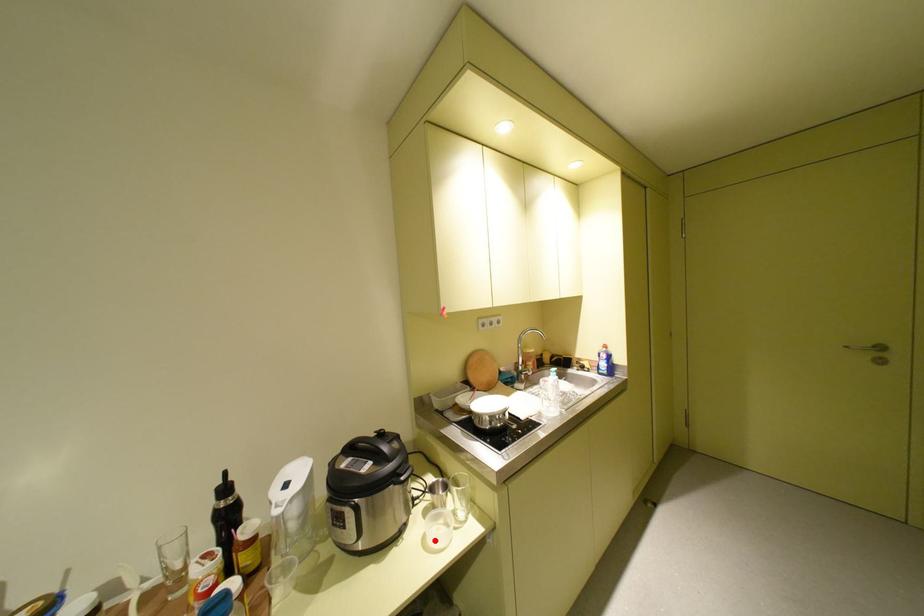
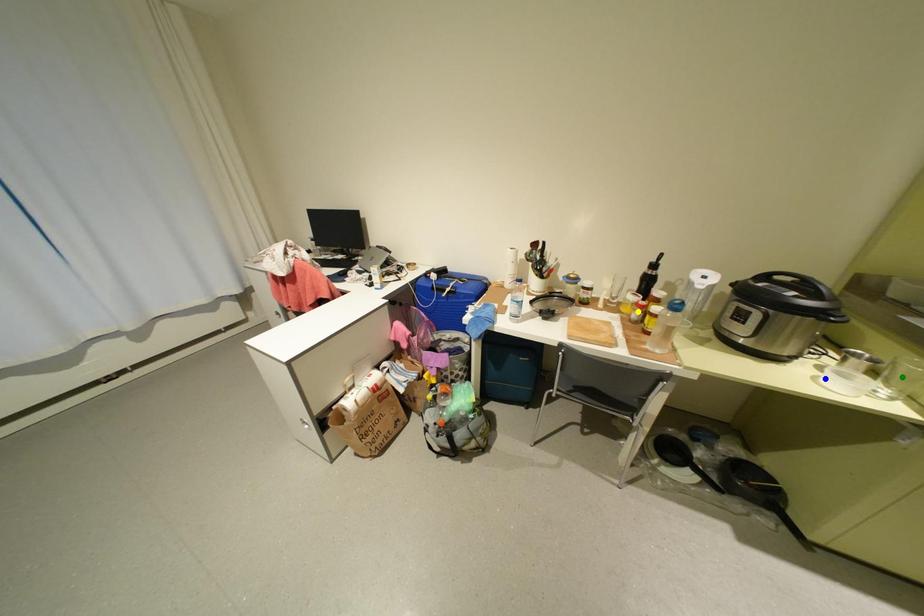
Question: I am providing you with two images of the same scene from different viewpoints. A red point is marked on the first image. You are given multiple points on the second image. Can you choose the point in image 2 that corresponds to the point in image 1?

Choices:
 (A) blue point
 (B) green point
 (C) yellow point

Answer: (A)